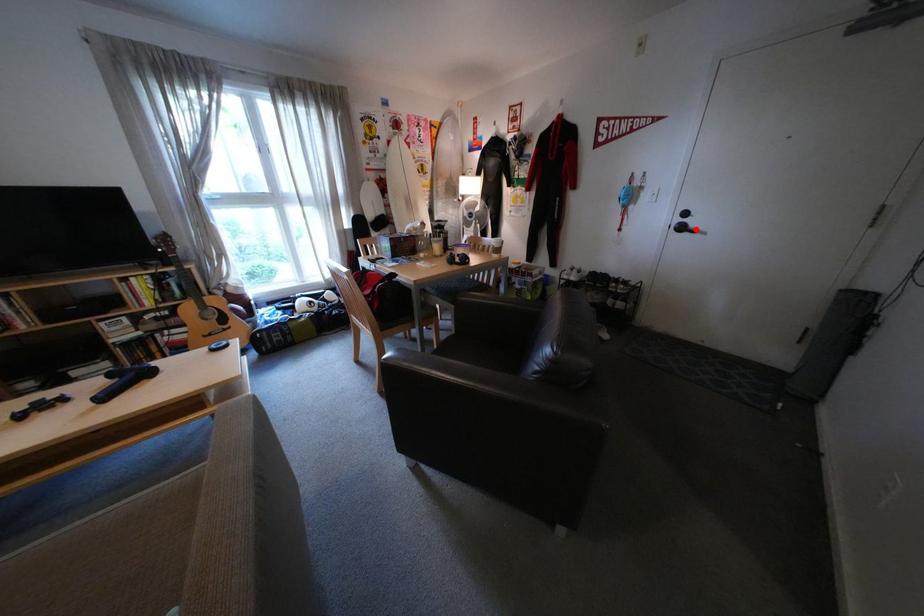
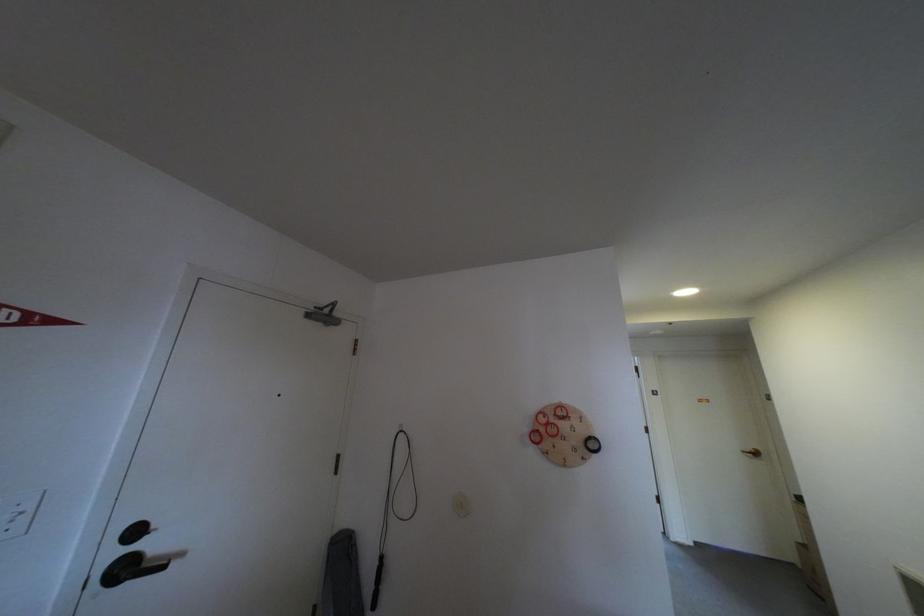
The point at the highlighted location is marked in the first image. Where is the corresponding point in the second image?

(140, 570)